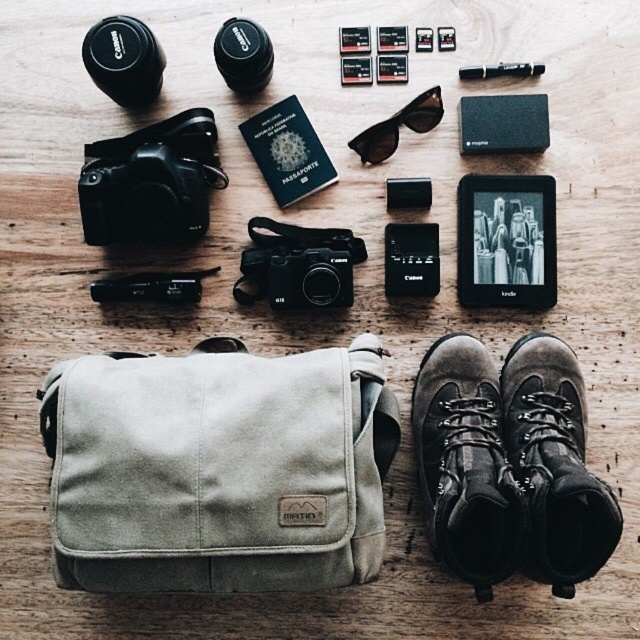
Based on the photo, you are packing for a trip and need to place your canvas messenger bag at lower left and leather boots at lower center into a storage compartment. Which item should you place first to ensure both fit properly?

You should place the leather boots at lower center first because the canvas messenger bag at lower left is located above it, meaning the bag is closer to the top and the boots are lower down. Placing the boots first allows the bag to sit on top without overcrowding the compartment.

You are packing for a trip and need to choose between the canvas messenger bag at lower left and the metallic pen at upper center. Which item can hold more items?

The canvas messenger bag at lower left is bigger than the metallic pen at upper center, so it can hold more items.